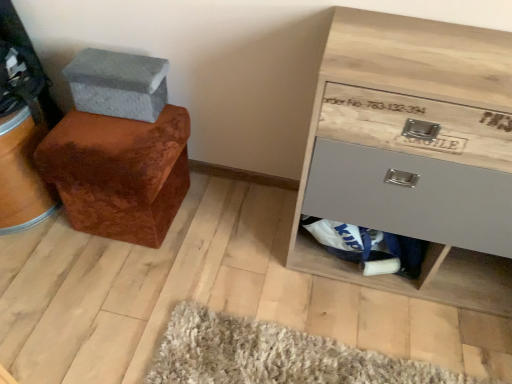
Locate an element on the screen. Image resolution: width=512 pixels, height=384 pixels. vacant space to the left of wooden chest of drawers at lower right is located at coordinates point(251,250).